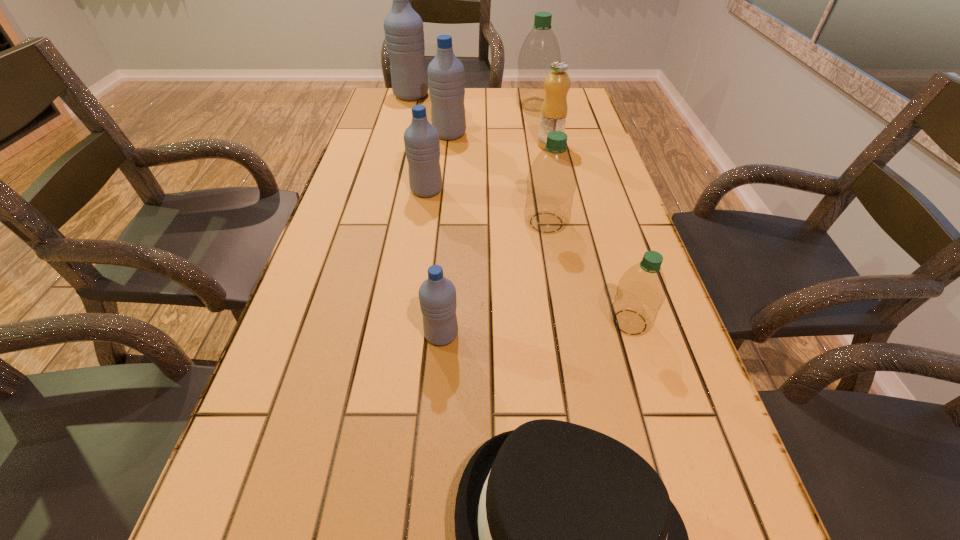
Locate an element on the screen. The height and width of the screenshot is (540, 960). vacant point located between the nearest green water bottle and the fifth farthest object is located at coordinates (528, 256).

This screenshot has height=540, width=960. Identify the location of blank region between the smallest blue water bottle and the farthest green water bottle. (489, 220).

Identify the location of vacant space in between the fruit juice and the third farthest blue water bottle. (489, 168).

Locate an element on the screen. The width and height of the screenshot is (960, 540). object that stands as the eighth closest to the smallest green water bottle is located at coordinates (403, 27).

At what (x,y) coordinates should I click in order to perform the action: click on object that stands as the closest to the nearest blue water bottle. Please return your answer as a coordinate pair (x, y). Looking at the image, I should click on (566, 539).

This screenshot has height=540, width=960. Identify the location of water bottle that is the fifth closest to the second biggest green water bottle. (540, 49).

Locate which water bottle ranks in proximity to the second biggest green water bottle. Please provide its 2D coordinates. Your answer should be formatted as a tuple, i.e. [(x, y)], where the tuple contains the x and y coordinates of a point satisfying the conditions above.

[(421, 139)]

This screenshot has height=540, width=960. What are the coordinates of `blue water bottle that is the third closest to the tallest object` in the screenshot? It's located at (437, 295).

The height and width of the screenshot is (540, 960). Identify the location of blue water bottle that is the second closest one to the fifth nearest water bottle. (421, 139).

The image size is (960, 540). Identify the location of green water bottle object that ranks as the second closest to the black fedora. tap(551, 181).